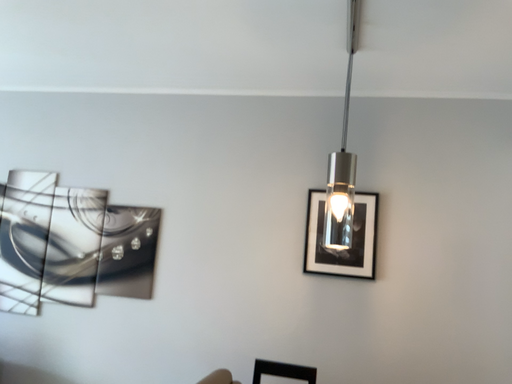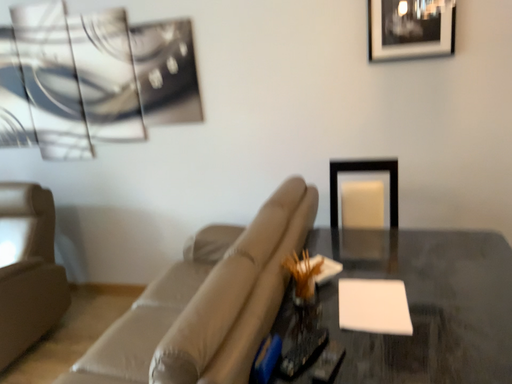
Question: How did the camera likely rotate when shooting the video?

Choices:
 (A) rotated downward
 (B) rotated upward

Answer: (A)